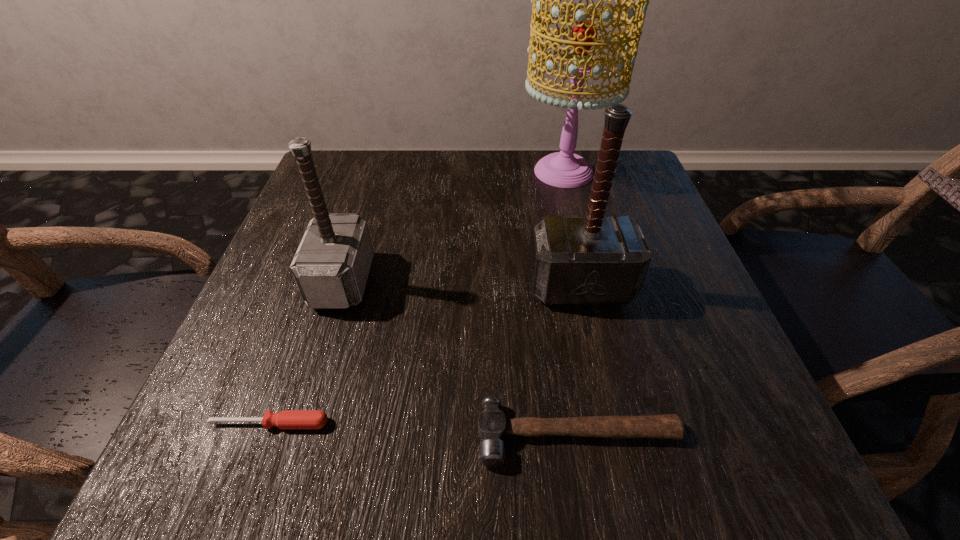
This screenshot has height=540, width=960. Identify the location of blank area located for striking with the head of the second tallest hammer. (479, 281).

At what (x,y) coordinates should I click in order to perform the action: click on vacant area situated on the back of the screwdriver. Please return your answer as a coordinate pair (x, y). This screenshot has width=960, height=540. Looking at the image, I should click on tap(338, 234).

You are a GUI agent. You are given a task and a screenshot of the screen. Output one action in this format:
    pyautogui.click(x=<x>, y=<y>)
    Task: Click on the object situated at the far edge
    
    Given the screenshot: What is the action you would take?
    pyautogui.click(x=564, y=169)

This screenshot has height=540, width=960. Find the location of `hammer that is at the near edge`. hammer that is at the near edge is located at coordinates (492, 425).

You are a GUI agent. You are given a task and a screenshot of the screen. Output one action in this format:
    pyautogui.click(x=<x>, y=<y>)
    Task: Click on the screwdriver that is at the near edge
    The width and height of the screenshot is (960, 540).
    Given the screenshot: What is the action you would take?
    pyautogui.click(x=286, y=419)

Locate an element on the screen. hammer positioned at the left edge is located at coordinates (331, 266).

Find the location of a particular element. screwdriver located at the left edge is located at coordinates point(286,419).

Identify the location of lampshade positioned at the right edge. (564, 169).

You are a GUI agent. You are given a task and a screenshot of the screen. Output one action in this format:
    pyautogui.click(x=<x>, y=<y>)
    Task: Click on the object at the near left corner
    
    Given the screenshot: What is the action you would take?
    pyautogui.click(x=286, y=419)

The height and width of the screenshot is (540, 960). What are the coordinates of `object that is positioned at the far right corner` in the screenshot? It's located at (564, 169).